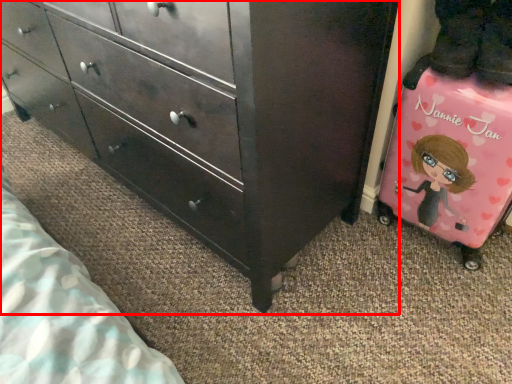
Question: From the image's perspective, what is the correct spatial positioning of chest of drawers (annotated by the red box) in reference to luggage?

Choices:
 (A) above
 (B) below

Answer: (A)